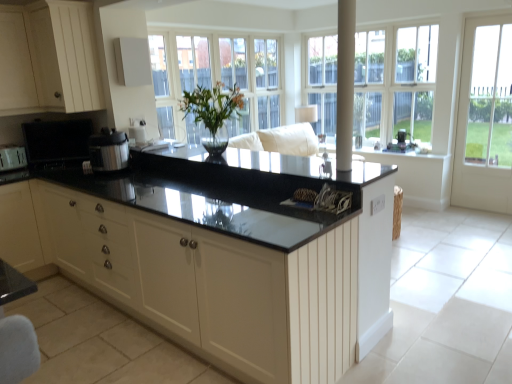
This screenshot has height=384, width=512. I want to click on vacant region above matte black television at left, the third appliance when ordered from front to back (from a real-world perspective), so click(x=65, y=124).